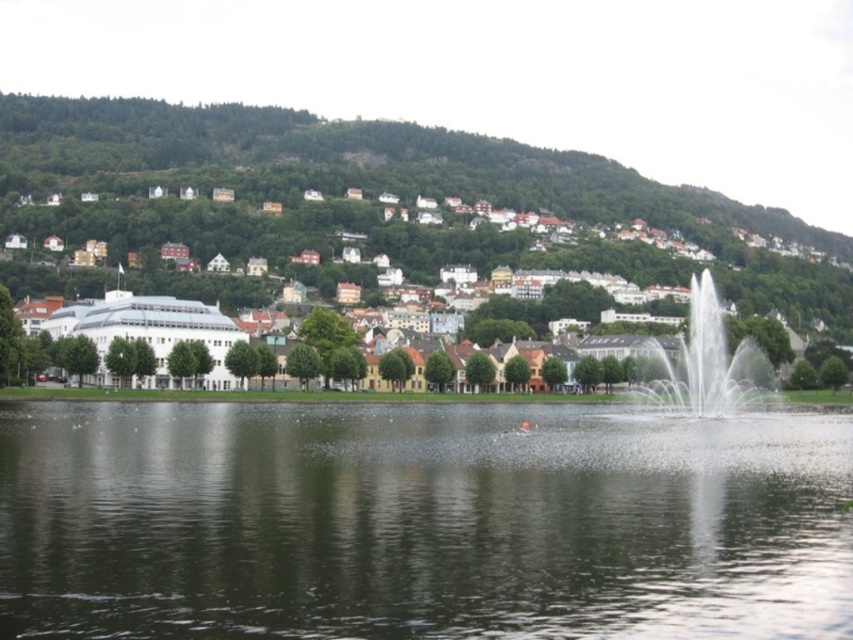
Question: Can you confirm if clear water at center is wider than green grassy hillside at upper left?

Choices:
 (A) yes
 (B) no

Answer: (B)

Question: Is clear water at center smaller than green grassy hillside at upper left?

Choices:
 (A) no
 (B) yes

Answer: (B)

Question: Which object appears farthest from the camera in this image?

Choices:
 (A) white matte building at center
 (B) white frothy water at right

Answer: (A)

Question: Is clear water at center wider than white frothy water at right?

Choices:
 (A) no
 (B) yes

Answer: (B)

Question: Among these points, which one is nearest to the camera?

Choices:
 (A) (461, 538)
 (B) (573, 192)
 (C) (840, 273)
 (D) (657, 406)

Answer: (A)

Question: Which object appears farthest from the camera in this image?

Choices:
 (A) white frothy water at right
 (B) green grassy hillside at upper left

Answer: (B)